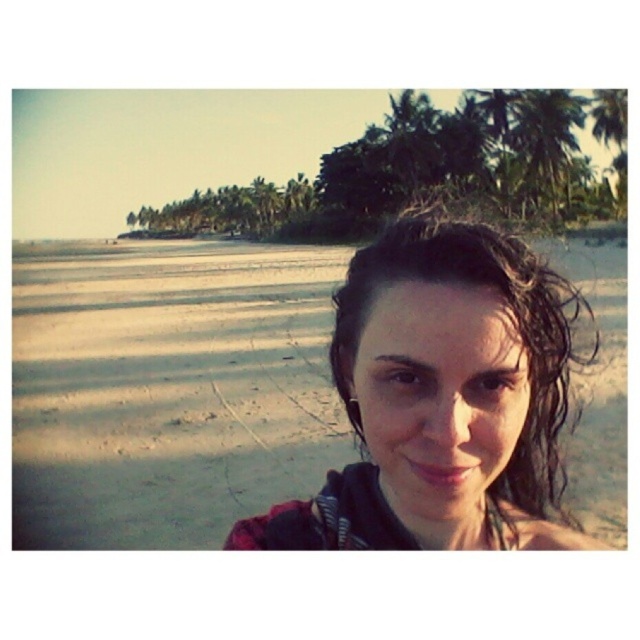
Looking at this image, you are a photographer trying to capture the person with the wet hair at center and the green leafy palm tree at upper right in the same frame. Based on their heights, will the palm tree be taller than the person in the photo?

The wet hair at center is shorter than the green leafy palm tree at upper right, so yes, the palm tree will appear taller than the person in the photo.

You are standing on the beach and see the wet hair at center and the green leafy palm tree at upper right. Which object is closer to the left side of the image?

The wet hair at center is to the left of the green leafy palm tree at upper right, so it is closer to the left side of the image.

You are a photographer standing at the beach scene. You want to take a photo of the wet hair at center and the green leafy palm tree at upper right. Which object should you focus on first to ensure both are in sharp focus?

You should focus on the wet hair at center first because it is closer to the viewer than the green leafy palm tree at upper right, so adjusting focus from near to far will help both be in sharp focus.